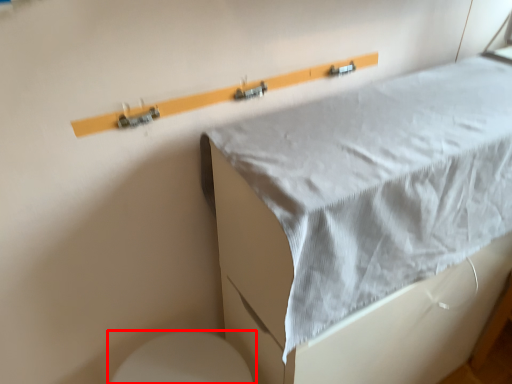
Question: From the image's perspective, what is the correct spatial relationship of toilet (annotated by the red box) in relation to furniture?

Choices:
 (A) below
 (B) above

Answer: (A)